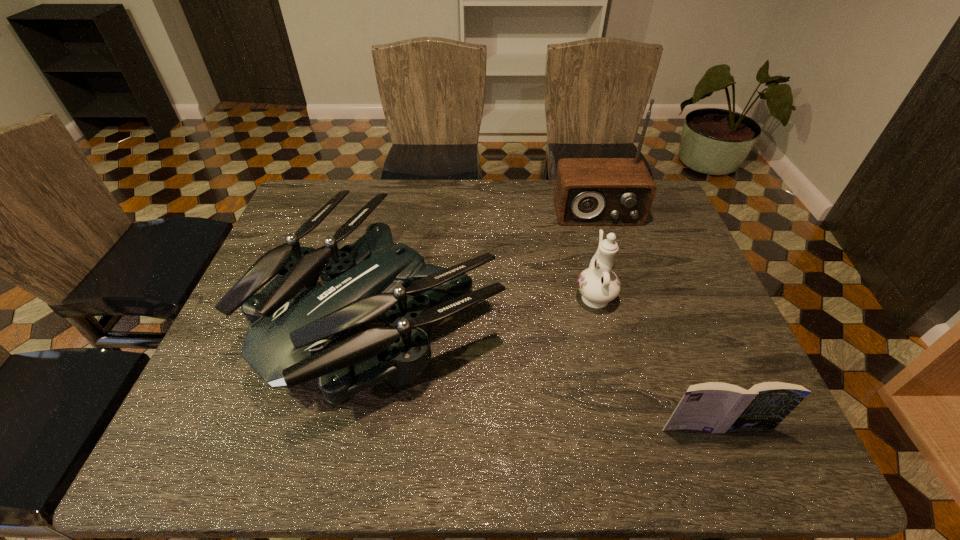
This screenshot has height=540, width=960. I want to click on radio receiver, so click(588, 191).

Image resolution: width=960 pixels, height=540 pixels. In order to click on the tallest object in this screenshot , I will do 588,191.

At what (x,y) coordinates should I click in order to perform the action: click on chinaware. Please return your answer as a coordinate pair (x, y). Image resolution: width=960 pixels, height=540 pixels. Looking at the image, I should click on [x=598, y=285].

This screenshot has width=960, height=540. Identify the location of the leftmost object. (299, 331).

At what (x,y) coordinates should I click in order to perform the action: click on book. Please return your answer as a coordinate pair (x, y). This screenshot has height=540, width=960. Looking at the image, I should click on (715, 407).

The height and width of the screenshot is (540, 960). I want to click on vacant space located on the front-facing side of the farthest object, so click(618, 280).

This screenshot has width=960, height=540. I want to click on vacant space located at the spout of the chinaware, so click(x=585, y=256).

At what (x,y) coordinates should I click in order to perform the action: click on vacant area located 0.310m at the spout of the chinaware. Please return your answer as a coordinate pair (x, y). The height and width of the screenshot is (540, 960). Looking at the image, I should click on (573, 208).

The width and height of the screenshot is (960, 540). What are the coordinates of `vacant region located at the spout of the chinaware` in the screenshot? It's located at (578, 230).

Where is `free region located on the back of the leftmost object`? The image size is (960, 540). free region located on the back of the leftmost object is located at coordinates (409, 186).